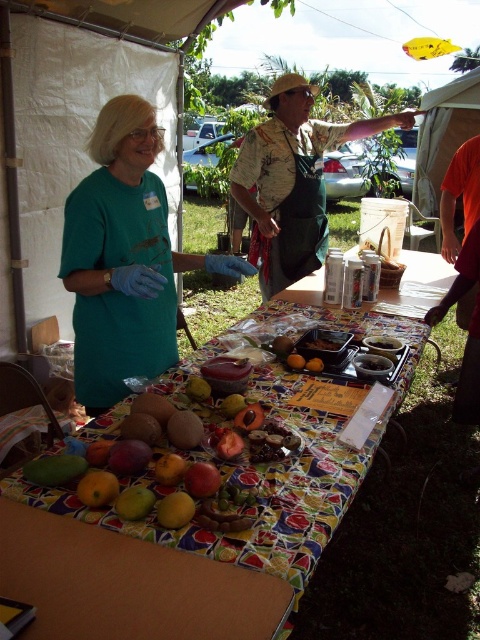
Question: Is teal fabric shirt at upper left behind green matte mango at center?

Choices:
 (A) no
 (B) yes

Answer: (B)

Question: Among these objects, which one is nearest to the camera?

Choices:
 (A) hawaiian shirt at center
 (B) teal fabric shirt at upper left

Answer: (B)

Question: Is yellow matte mango at lower left below green matte mango at center?

Choices:
 (A) yes
 (B) no

Answer: (B)

Question: Which of the following is the closest to the observer?

Choices:
 (A) (120, 209)
 (B) (120, 493)

Answer: (B)

Question: Which object is closer to the camera taking this photo?

Choices:
 (A) green matte mango at center
 (B) hawaiian shirt at center
 (C) yellow matte mango at lower left

Answer: (A)

Question: Is hawaiian shirt at center to the right of yellow matte mango at lower left from the viewer's perspective?

Choices:
 (A) no
 (B) yes

Answer: (B)